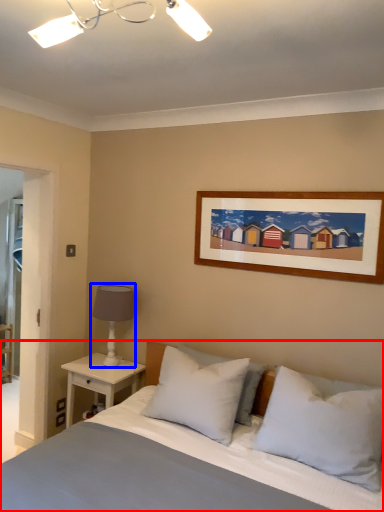
Question: Which object is closer to the camera taking this photo, bed (highlighted by a red box) or table lamp (highlighted by a blue box)?

Choices:
 (A) bed
 (B) table lamp

Answer: (A)